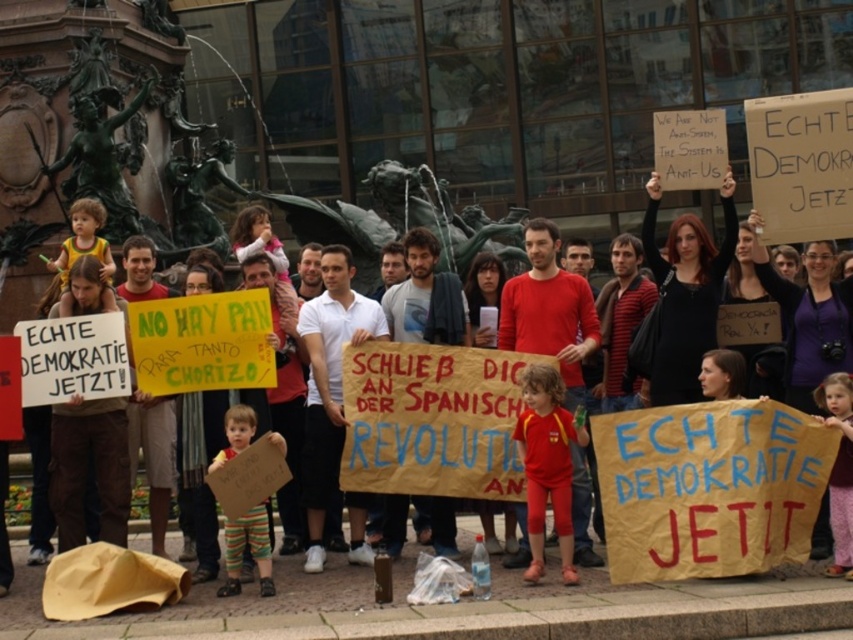
Question: Among these objects, which one is nearest to the camera?

Choices:
 (A) yellow cotton shirt at left
 (B) matte red t-shirt at center

Answer: (B)

Question: Considering the real-world distances, which object is farthest from the dusty pink fabric at lower right?

Choices:
 (A) yellow cotton shirt at left
 (B) matte red t-shirt at center
 (C) striped cotton pants at lower center

Answer: (A)

Question: Does dusty pink fabric at lower right have a greater width compared to yellow cotton shirt at left?

Choices:
 (A) no
 (B) yes

Answer: (A)

Question: Does matte red t-shirt at center have a smaller size compared to striped cotton pants at lower center?

Choices:
 (A) yes
 (B) no

Answer: (B)

Question: Which point appears closest to the camera in this image?

Choices:
 (A) (236, 417)
 (B) (561, 564)
 (C) (64, 256)
 (D) (848, 506)

Answer: (D)

Question: Does matte red t-shirt at center appear on the left side of striped cotton pants at lower center?

Choices:
 (A) yes
 (B) no

Answer: (B)